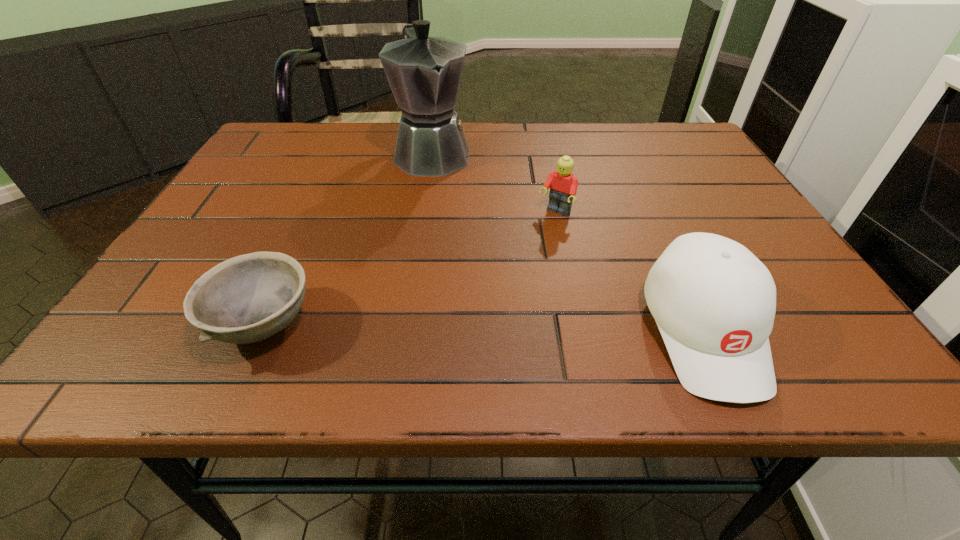
What are the coordinates of `free spot on the desktop that is between the bowl and the rightmost object and is positioned on the face of the third nearest object` in the screenshot? It's located at (462, 327).

The width and height of the screenshot is (960, 540). What are the coordinates of `free spot on the desktop that is between the leftmost object and the baseball cap and is positioned at the spout of the coffeepot` in the screenshot? It's located at (530, 328).